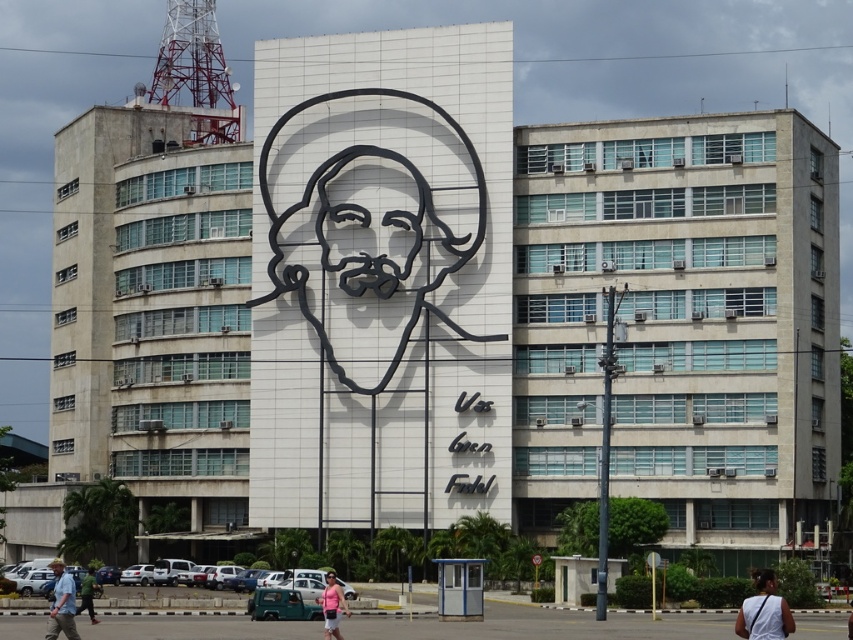
You are standing in front of the building with the mural of the man in the wide brimmed hat. There are two points marked on the building facade at coordinates point [782,605] and point [329,582]. Which of these points is closer to you?

Point [782,605] is closer to the viewer than point [329,582].

You are an art student analyzing the mural on the building. You notice the pink fabric at center and the matte black face at center. According to the spatial arrangement, which object is positioned to the right of the other?

The pink fabric at center is to the right of the matte black face at center.